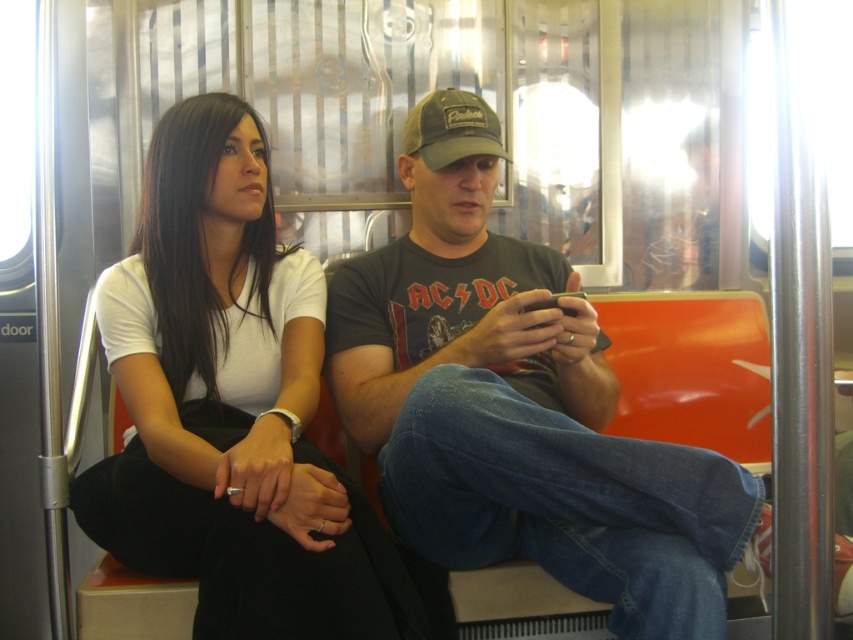
Can you confirm if dark gray t-shirt at center is positioned below white matte shirt at upper left?

Yes, dark gray t-shirt at center is below white matte shirt at upper left.

Is point (570, 452) less distant than point (325, 465)?

Yes, point (570, 452) is closer to viewer.

What do you see at coordinates (517, 404) in the screenshot? Image resolution: width=853 pixels, height=640 pixels. I see `dark gray t-shirt at center` at bounding box center [517, 404].

In order to click on dark gray t-shirt at center in this screenshot , I will do `click(517, 404)`.